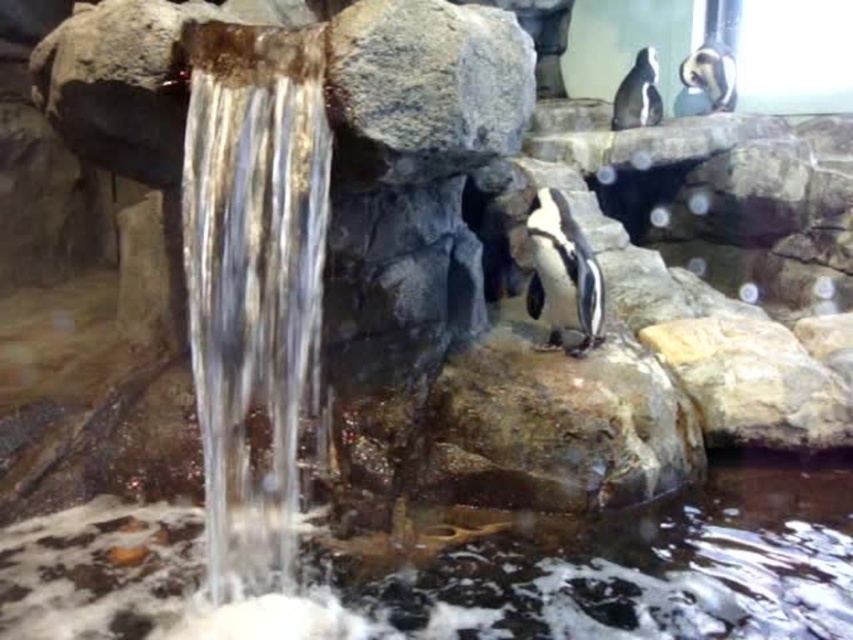
Which is in front, point (541, 237) or point (657, 104)?

Point (541, 237)

Between black and white feathers at center and black and white penguin at upper right, which one appears on the left side from the viewer's perspective?

black and white feathers at center

Which is in front, point (534, 234) or point (625, 81)?

Point (534, 234) is in front.

This screenshot has height=640, width=853. What are the coordinates of `black and white feathers at center` in the screenshot? It's located at (563, 273).

Who is higher up, black and white penguin at upper right or black glossy penguin at upper right?

black glossy penguin at upper right is higher up.

Measure the distance between black and white penguin at upper right and camera.

25.03 feet

Where is `black and white penguin at upper right`? This screenshot has width=853, height=640. black and white penguin at upper right is located at coordinates (637, 93).

Based on the photo, is clear water at center shorter than black glossy penguin at upper right?

Indeed, clear water at center has a lesser height compared to black glossy penguin at upper right.

Image resolution: width=853 pixels, height=640 pixels. I want to click on clear water at center, so click(471, 570).